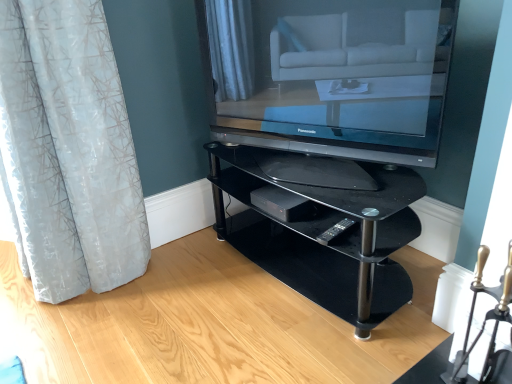
Question: Is black glass shelf at center positioned in front of matte black television at center?

Choices:
 (A) no
 (B) yes

Answer: (A)

Question: Does black glass shelf at center have a smaller size compared to matte black television at center?

Choices:
 (A) no
 (B) yes

Answer: (A)

Question: Could you tell me if black glass shelf at center is turned towards matte black television at center?

Choices:
 (A) yes
 (B) no

Answer: (B)

Question: Does black glass shelf at center lie behind matte black television at center?

Choices:
 (A) no
 (B) yes

Answer: (B)

Question: Can you confirm if black glass shelf at center is bigger than matte black television at center?

Choices:
 (A) yes
 (B) no

Answer: (A)

Question: Is matte black television at center completely or partially inside black glass shelf at center?

Choices:
 (A) no
 (B) yes

Answer: (A)

Question: Is the depth of matte black television at center greater than that of black plastic remote at lower center?

Choices:
 (A) yes
 (B) no

Answer: (B)

Question: Does matte black television at center have a lesser width compared to black plastic remote at lower center?

Choices:
 (A) yes
 (B) no

Answer: (B)

Question: Does matte black television at center appear on the left side of black plastic remote at lower center?

Choices:
 (A) yes
 (B) no

Answer: (A)

Question: Is matte black television at center to the right of black plastic remote at lower center from the viewer's perspective?

Choices:
 (A) yes
 (B) no

Answer: (B)

Question: Is matte black television at center positioned with its back to black plastic remote at lower center?

Choices:
 (A) yes
 (B) no

Answer: (B)

Question: Does matte black television at center lie in front of black plastic remote at lower center?

Choices:
 (A) yes
 (B) no

Answer: (A)

Question: Considering the relative sizes of matte black television at center and black glass shelf at center in the image provided, is matte black television at center thinner than black glass shelf at center?

Choices:
 (A) yes
 (B) no

Answer: (A)